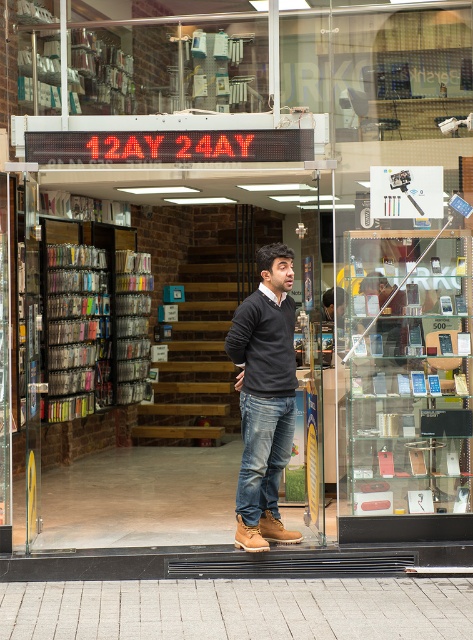
You are a customer entering the electronics store and see the dark gray sweater at center and the metallic silver books at left. Which item is smaller in size?

The dark gray sweater at center is smaller compared to the metallic silver books at left.

You are a customer looking at the electronics store window. You see both the transparent glass display case at center and the dark gray sweater at center. Which object is closer to you through the glass?

The transparent glass display case at center is closer to you than the dark gray sweater at center because the dark gray sweater at center is behind it.